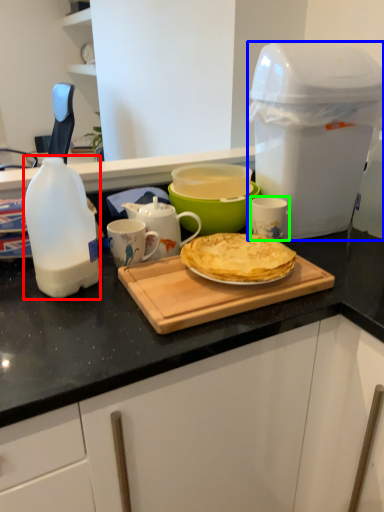
Question: Based on their relative distances, which object is farther from bottle (highlighted by a red box)? Choose from appliance (highlighted by a blue box) and mug (highlighted by a green box).

Choices:
 (A) appliance
 (B) mug

Answer: (A)